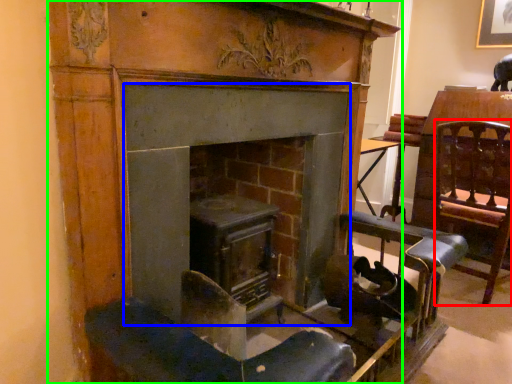
Question: Estimate the real-world distances between objects in this image. Which object is farther from swivel chair (highlighted by a red box), fireplace (highlighted by a blue box) or fireplace (highlighted by a green box)?

Choices:
 (A) fireplace
 (B) fireplace

Answer: (A)